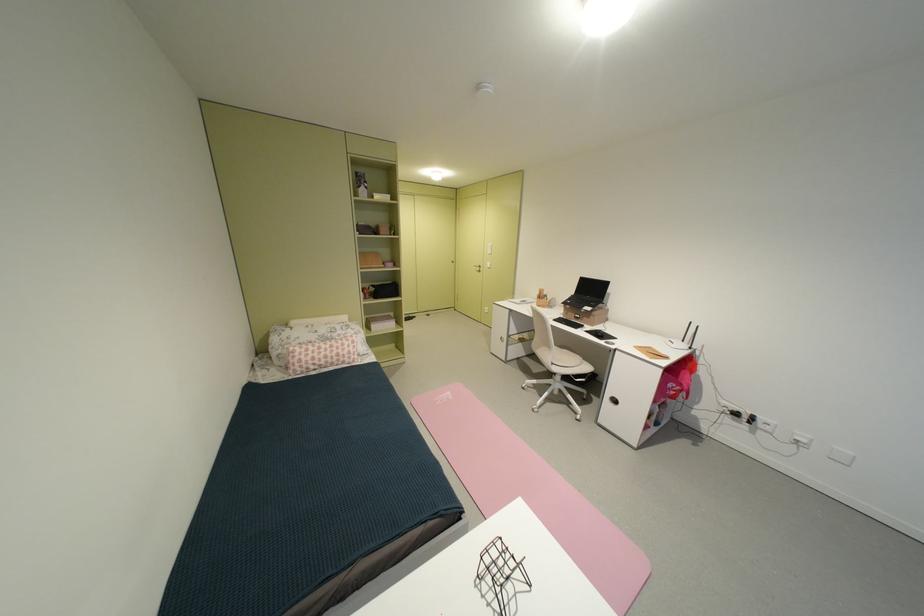
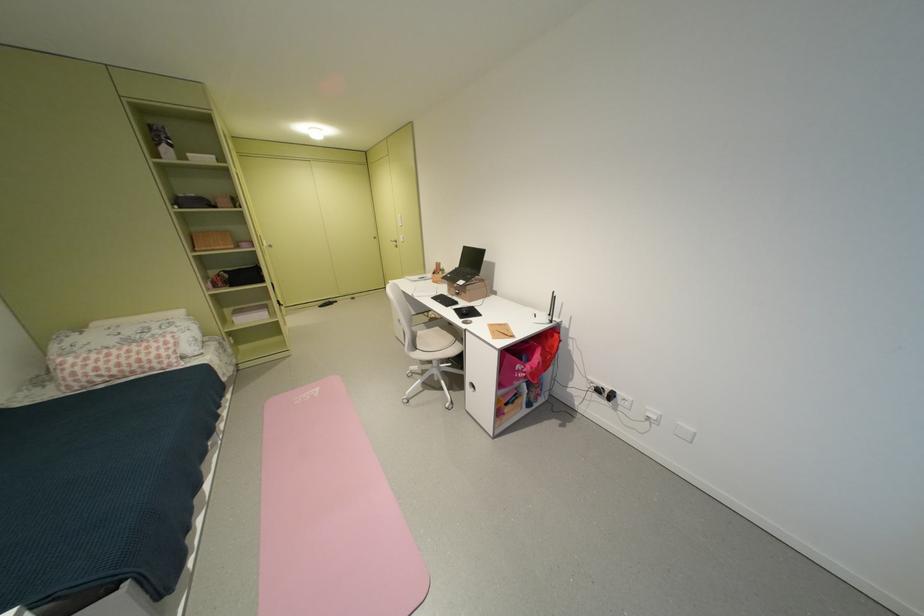
The point at (x=353, y=357) is marked in the first image. Where is the corresponding point in the second image?

(159, 362)